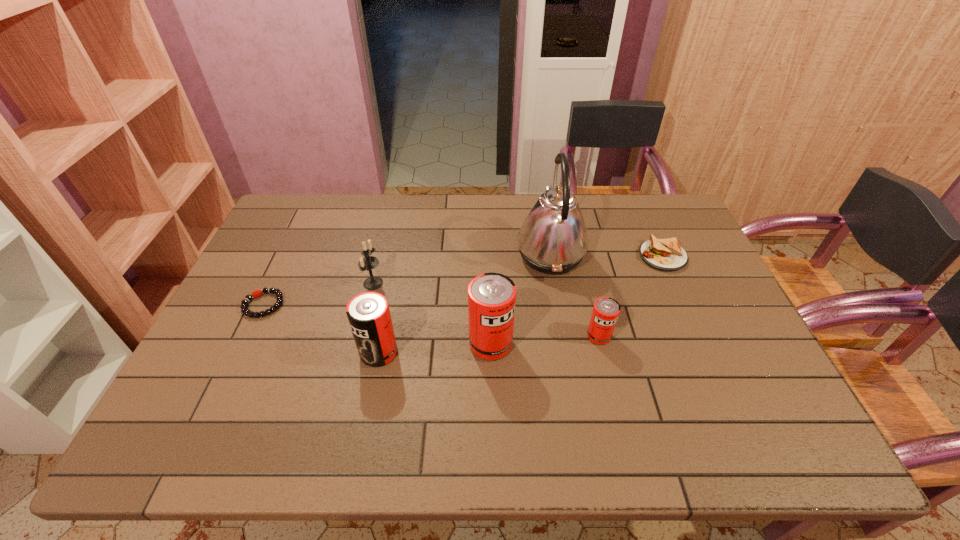
Locate an element on the screen. The image size is (960, 540). vacant point located 0.070m on the back of the second shortest can is located at coordinates (386, 318).

You are a GUI agent. You are given a task and a screenshot of the screen. Output one action in this format:
    pyautogui.click(x=<x>, y=<y>)
    Task: Click on the vacant space located 0.210m on the right of the second can from left to right
    
    Given the screenshot: What is the action you would take?
    pyautogui.click(x=594, y=344)

Locate an element on the screen. The height and width of the screenshot is (540, 960). vacant space located 0.230m on the left of the rightmost can is located at coordinates (499, 336).

In order to click on free space located 0.160m from the spout of the tallest object in this screenshot , I will do `click(465, 254)`.

Locate an element on the screen. This screenshot has width=960, height=540. vacant space located from the spout of the tallest object is located at coordinates (471, 254).

Find the location of `free point located 0.400m from the spout of the tallest object`. free point located 0.400m from the spout of the tallest object is located at coordinates (389, 254).

Find the location of `vacant space located 0.190m on the front of the shortest object`. vacant space located 0.190m on the front of the shortest object is located at coordinates (227, 380).

This screenshot has height=540, width=960. In order to click on vacant area situated 0.070m on the front of the rightmost object in this screenshot , I will do `click(677, 289)`.

The width and height of the screenshot is (960, 540). I want to click on blank area located 0.140m on the left of the candle holder, so click(x=315, y=284).

Locate an element on the screen. The height and width of the screenshot is (540, 960). object that is positioned at the far edge is located at coordinates (553, 239).